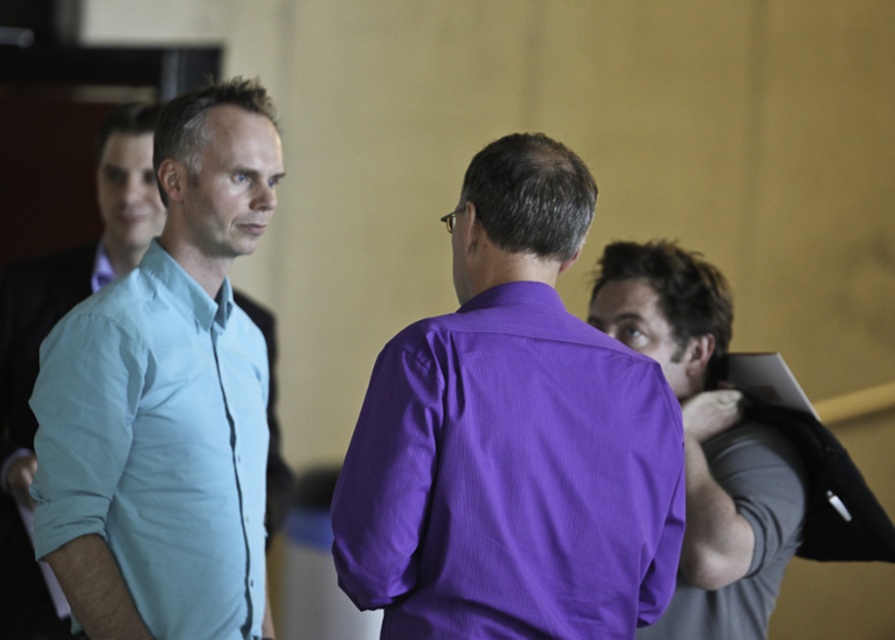
Does point (130, 470) lie behind point (720, 298)?

No, (130, 470) is closer to viewer.

This screenshot has width=895, height=640. What do you see at coordinates (159, 445) in the screenshot?
I see `light blue cotton shirt at left` at bounding box center [159, 445].

Who is more distant from viewer, [95,452] or [787,454]?

The point [787,454] is behind.

Find the location of a particular element. light blue cotton shirt at left is located at coordinates (159, 445).

Who is more distant from viewer, (531,148) or (186,522)?

The point (186,522) is more distant.

Identify the location of purple smooth shirt at center. (512, 438).

This screenshot has width=895, height=640. I want to click on purple smooth shirt at center, so [512, 438].

Identify the location of purple smooth shirt at center. (512, 438).

Find the location of `purple smooth shirt at center`. purple smooth shirt at center is located at coordinates (512, 438).